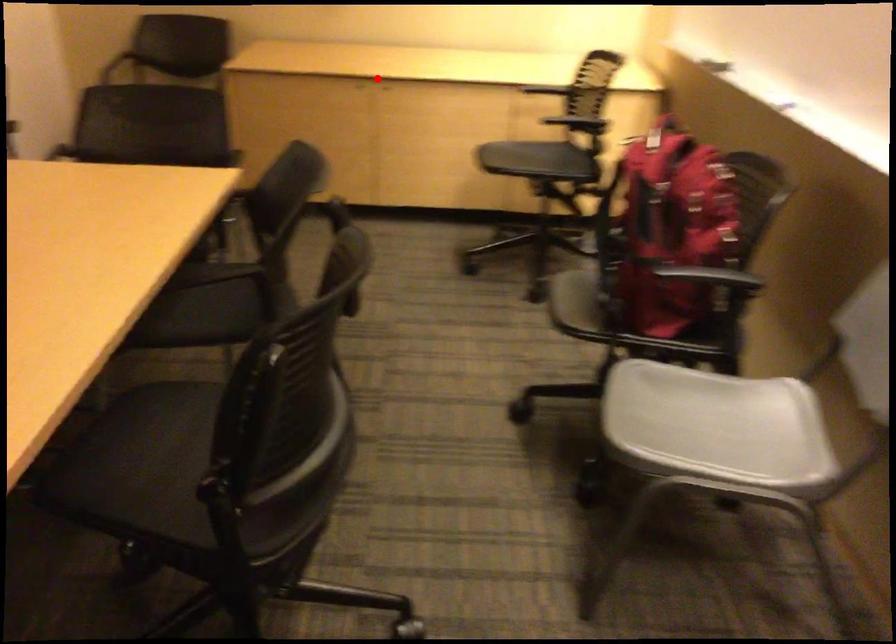
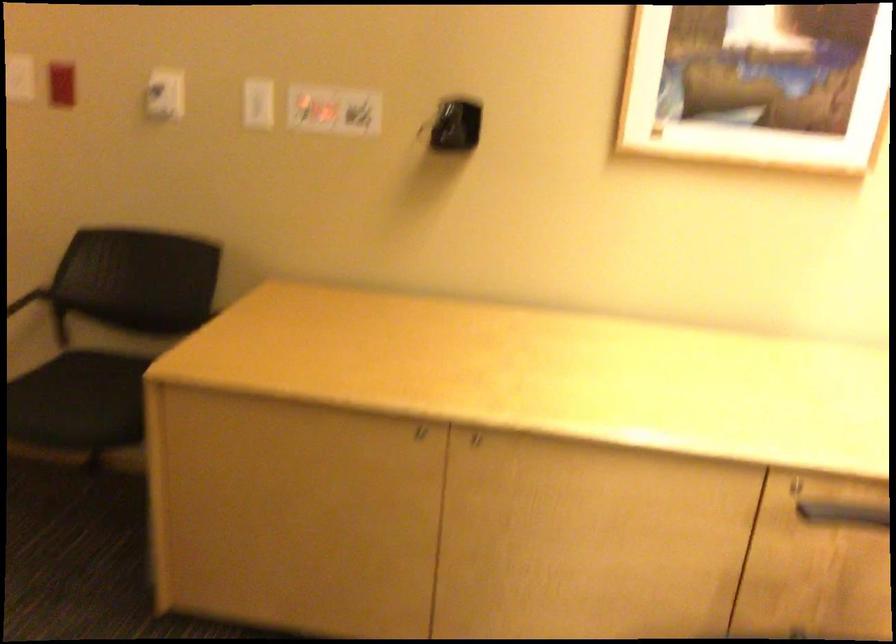
Question: I am providing you with two images of the same scene from different viewpoints. A red point is shown in image1. For the corresponding object point in image2, is it positioned nearer or farther from the camera?

Choices:
 (A) Nearer
 (B) Farther

Answer: (A)